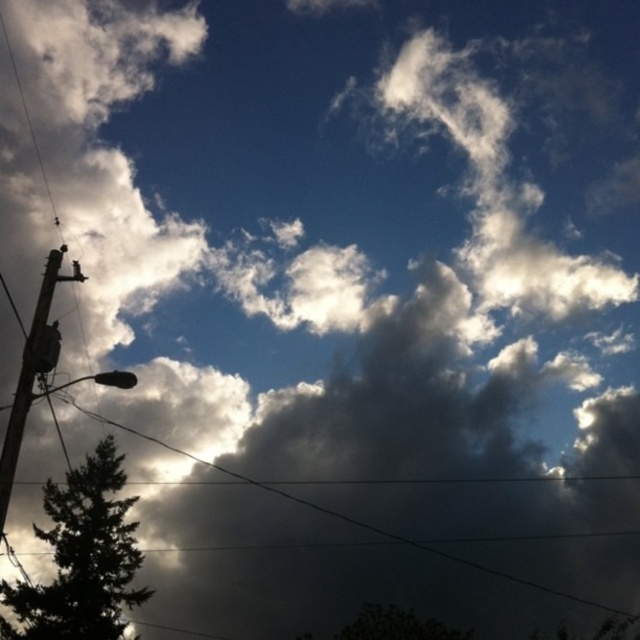
The width and height of the screenshot is (640, 640). What are the coordinates of `dark green leafy tree at lower left` in the screenshot? It's located at (83, 557).

Is dark green leafy tree at lower left wider than silhouette wooden pole at left?

No.

Does point (109, 592) come farther from viewer compared to point (1, 632)?

Yes.

The image size is (640, 640). I want to click on dark green leafy tree at lower left, so pyautogui.click(x=83, y=557).